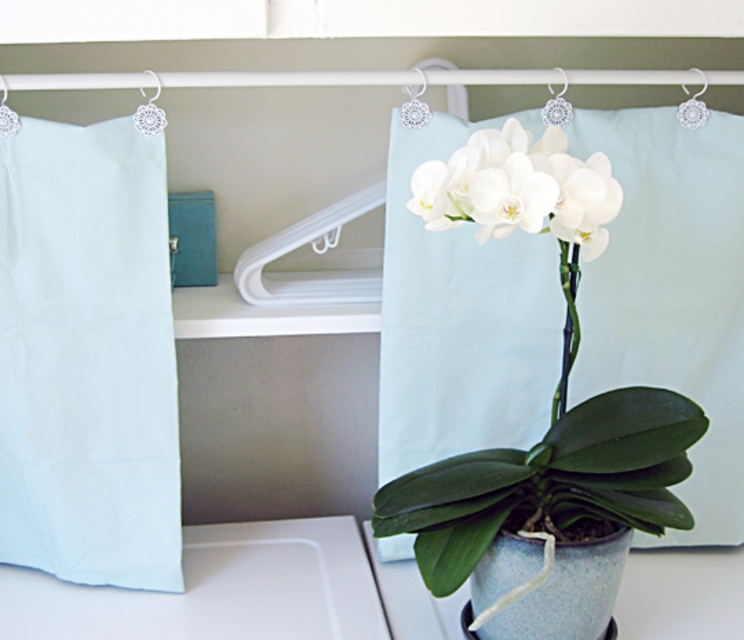
Question: Considering the relative positions of light blue fabric at left and white lace hanger at upper right in the image provided, where is light blue fabric at left located with respect to white lace hanger at upper right?

Choices:
 (A) right
 (B) left

Answer: (B)

Question: Which point is farther from the camera taking this photo?

Choices:
 (A) coord(682,115)
 (B) coord(153,116)
 (C) coord(60,522)
 (D) coord(446,209)

Answer: (C)

Question: Can you confirm if light blue fabric at left is thinner than speckled ceramic vase at center?

Choices:
 (A) no
 (B) yes

Answer: (A)

Question: Which of the following is the closest to the observer?

Choices:
 (A) white matte orchid at center
 (B) white lace hanger at upper right
 (C) speckled ceramic vase at center
 (D) white plastic hanger at upper left

Answer: (A)

Question: Does white matte orchid at center appear on the right side of speckled ceramic vase at center?

Choices:
 (A) no
 (B) yes

Answer: (A)

Question: Among these objects, which one is farthest from the camera?

Choices:
 (A) speckled ceramic vase at center
 (B) light blue fabric at left

Answer: (B)